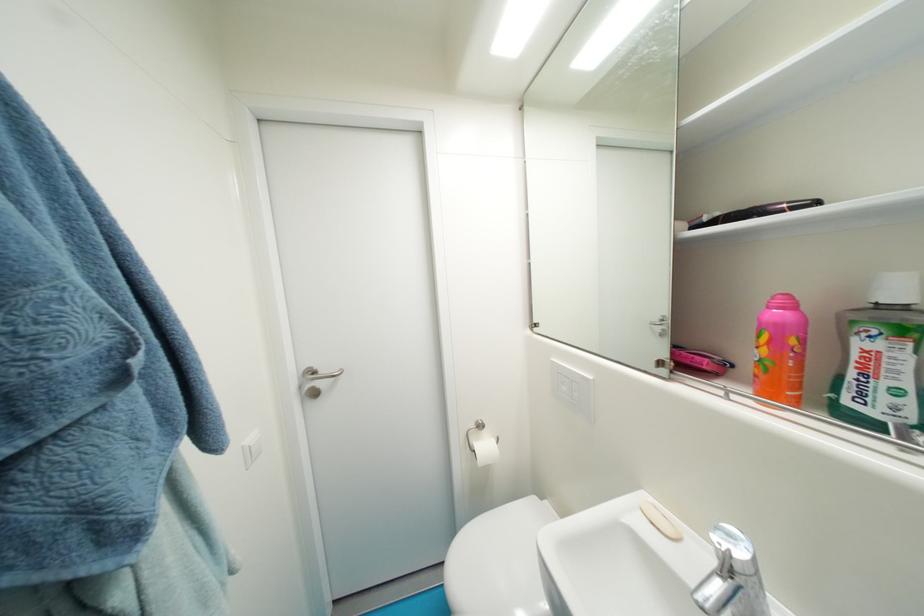
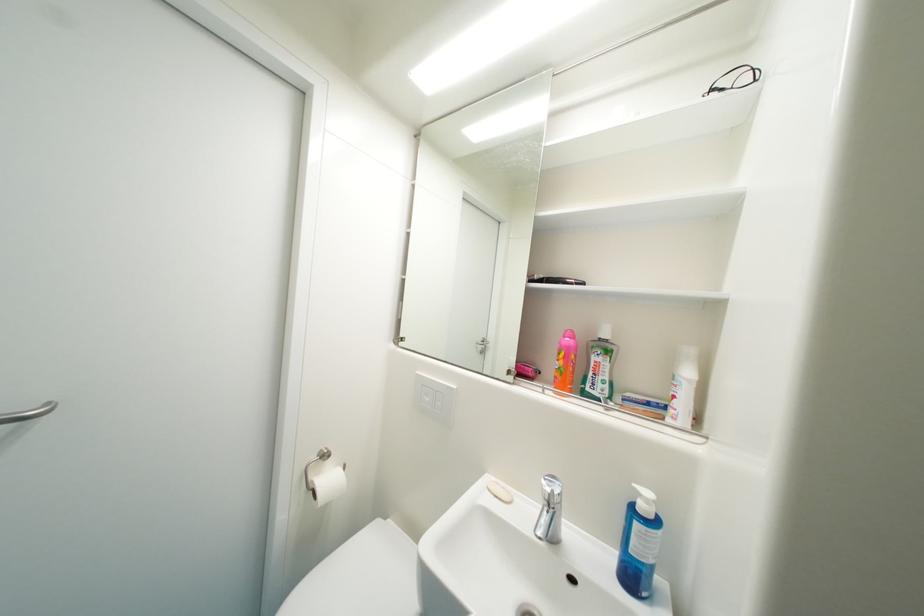
Question: The camera is either moving clockwise (left) or counter-clockwise (right) around the object. The first image is from the beginning of the video and the second image is from the end. Is the camera moving left or right when shooting the video?

Choices:
 (A) Left
 (B) Right

Answer: (A)